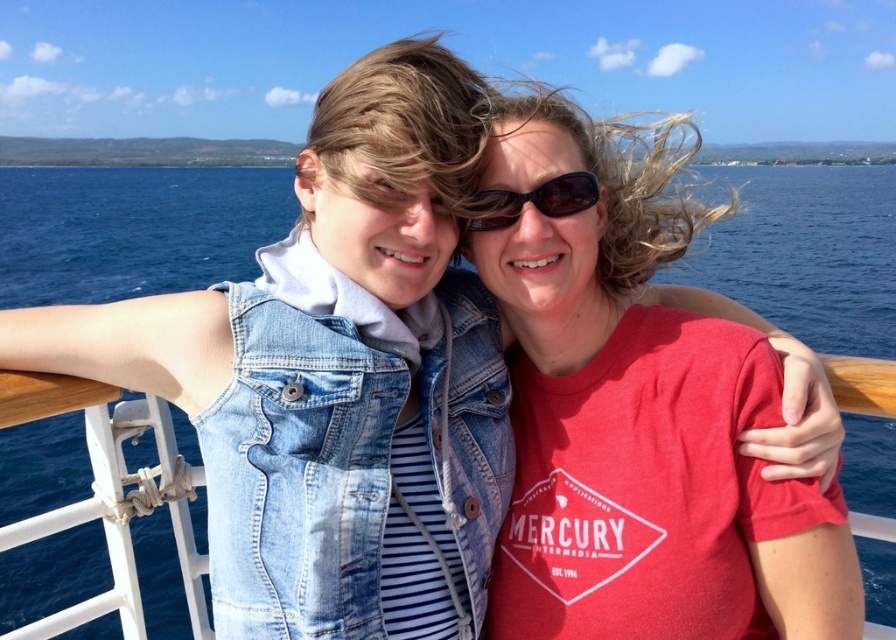
You are a photographer trying to capture a photo of the blue water at center and the black plastic sunglasses at center. Which object should you focus on first if you want both to be in sharp focus?

The black plastic sunglasses at center is behind blue water at center, so you should focus on the black plastic sunglasses at center first to ensure both are in sharp focus.